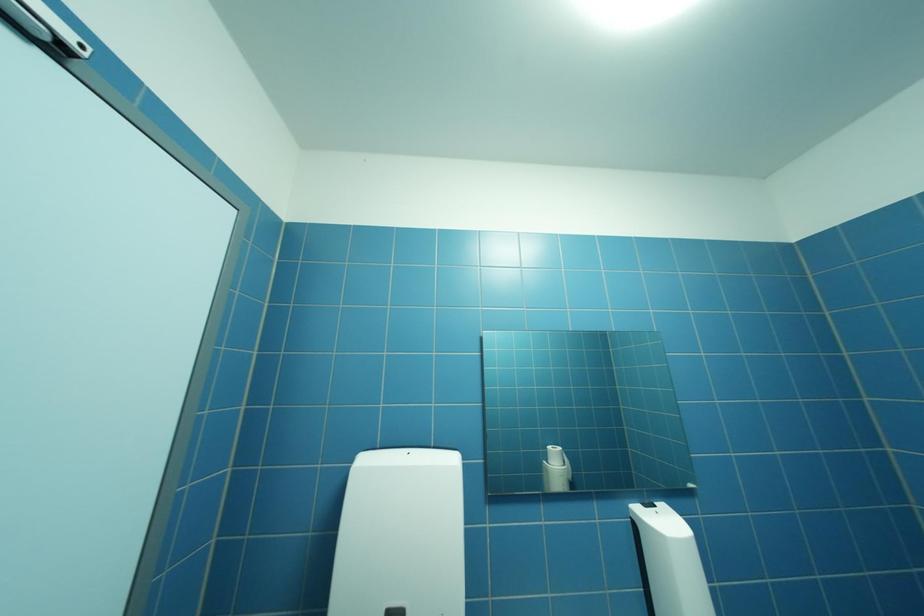
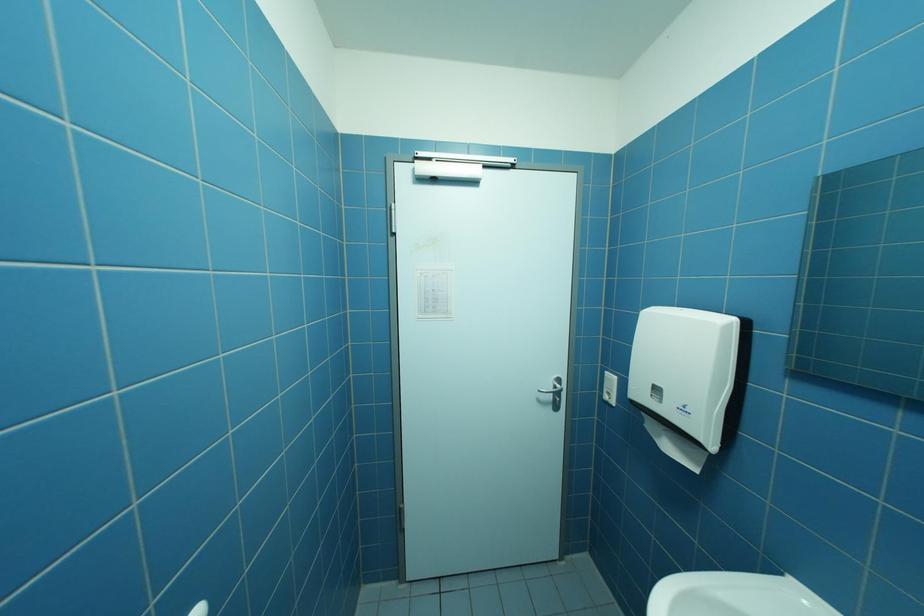
Question: The camera is either moving clockwise (left) or counter-clockwise (right) around the object. The first image is from the beginning of the video and the second image is from the end. Is the camera moving left or right when shooting the video?

Choices:
 (A) Left
 (B) Right

Answer: (B)